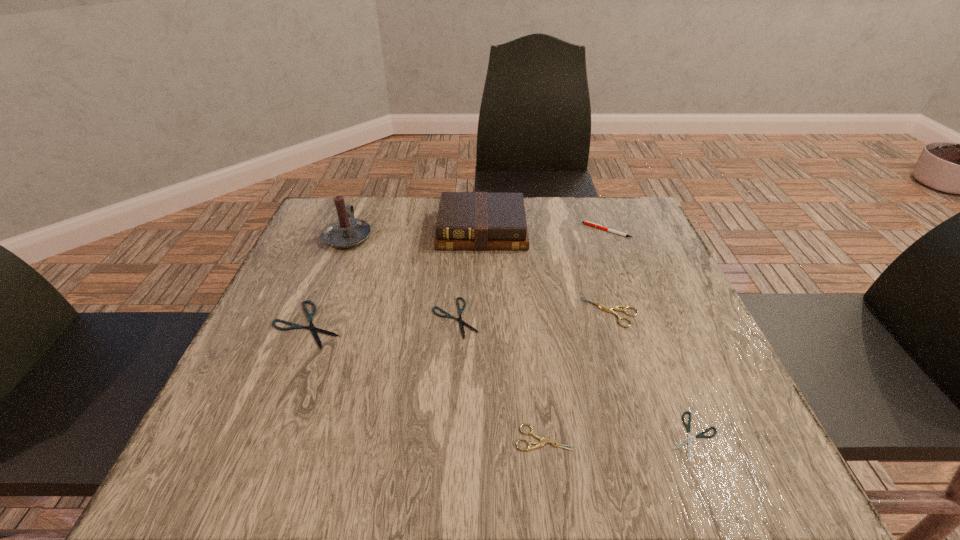
Find the location of a particular element. The height and width of the screenshot is (540, 960). the second smallest black shears is located at coordinates (461, 322).

The height and width of the screenshot is (540, 960). I want to click on the fourth shears from right to left, so click(461, 322).

Where is `the shortest shears`? The image size is (960, 540). the shortest shears is located at coordinates (700, 435).

Find the location of a particular element. This screenshot has width=960, height=540. the rightmost black shears is located at coordinates (700, 435).

Locate an element on the screen. The height and width of the screenshot is (540, 960). free point located 0.070m on the side of the tallest object with the handle loop is located at coordinates (360, 206).

You are a GUI agent. You are given a task and a screenshot of the screen. Output one action in this format:
    pyautogui.click(x=<x>, y=<y>)
    Task: Click on the vacant space located 0.080m on the side of the tallest object with the handle loop
    
    Given the screenshot: What is the action you would take?
    click(360, 205)

Find the location of `vacant region located 0.100m on the side of the tallest object with the handle loop`. vacant region located 0.100m on the side of the tallest object with the handle loop is located at coordinates (362, 201).

I want to click on vacant space located 0.270m on the spine side of the Bible, so click(x=482, y=335).

Where is `vacant space situated 0.320m on the clicker of the pen`? This screenshot has width=960, height=540. vacant space situated 0.320m on the clicker of the pen is located at coordinates (461, 231).

Locate an element on the screen. The height and width of the screenshot is (540, 960). free space located 0.150m on the clicker of the pen is located at coordinates (526, 231).